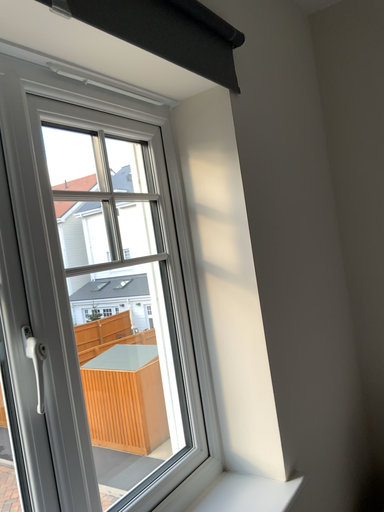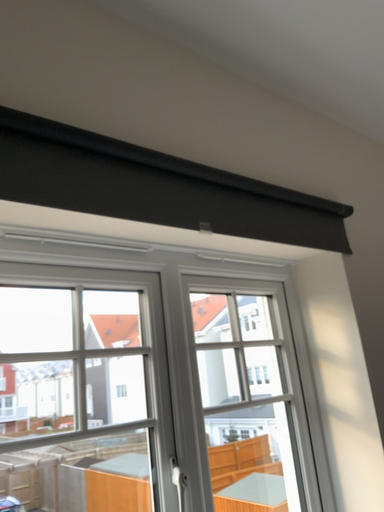
Question: Which way did the camera rotate in the video?

Choices:
 (A) rotated upward
 (B) rotated downward

Answer: (A)